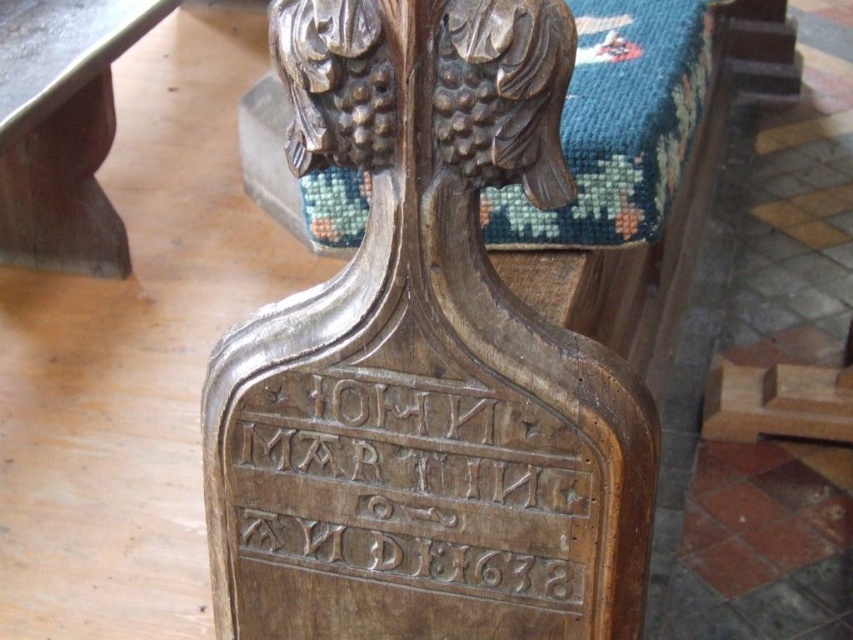
Consider the image. You are an interior designer planning to place a 1.2 meter wide sofa in front of the dark brown wood eagle at upper center. The sofa will be positioned 1.2 meters away from the wall. Is there enough space between the sofa and the wall to accommodate the sofa?

The distance between the sofa and the wall is 1.2 meters, which is greater than the sofa width of 1.2 meters. Therefore, there is enough space to place the sofa.

You are an interior designer planning to place a new lamp between the dark brown wood eagle at upper center and the wooden table at left. The lamp requires at least 1.2 meters of space between them. Is there enough space for the lamp?

The dark brown wood eagle at upper center and wooden table at left are 1.31 meters apart from each other, which is more than the required 1.2 meters. Therefore, there is enough space to place the lamp between them.